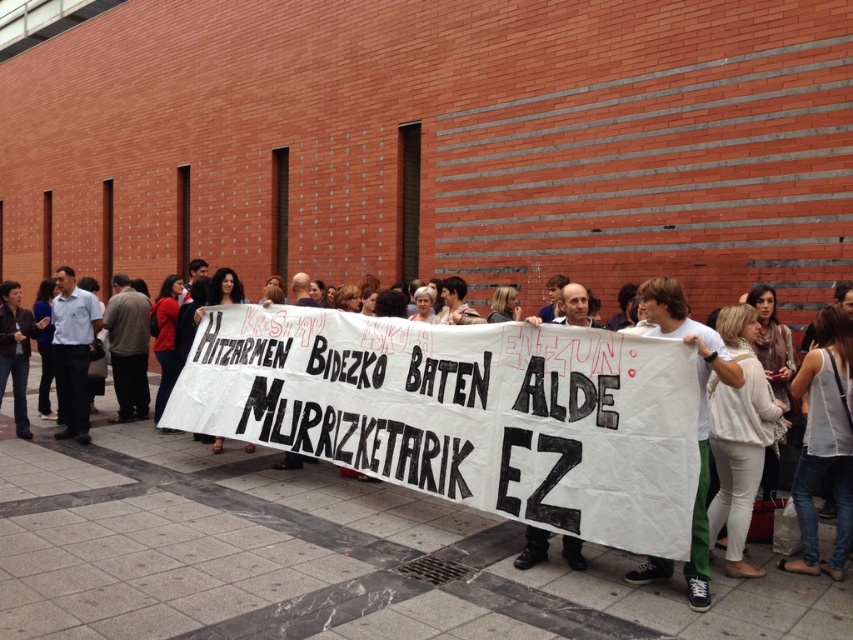
Question: Can you confirm if white paper banner at center is positioned below white fabric banner at center?

Choices:
 (A) yes
 (B) no

Answer: (B)

Question: Is white paper banner at center behind white fabric banner at center?

Choices:
 (A) yes
 (B) no

Answer: (A)

Question: Is white paper banner at center smaller than white fabric banner at center?

Choices:
 (A) yes
 (B) no

Answer: (B)